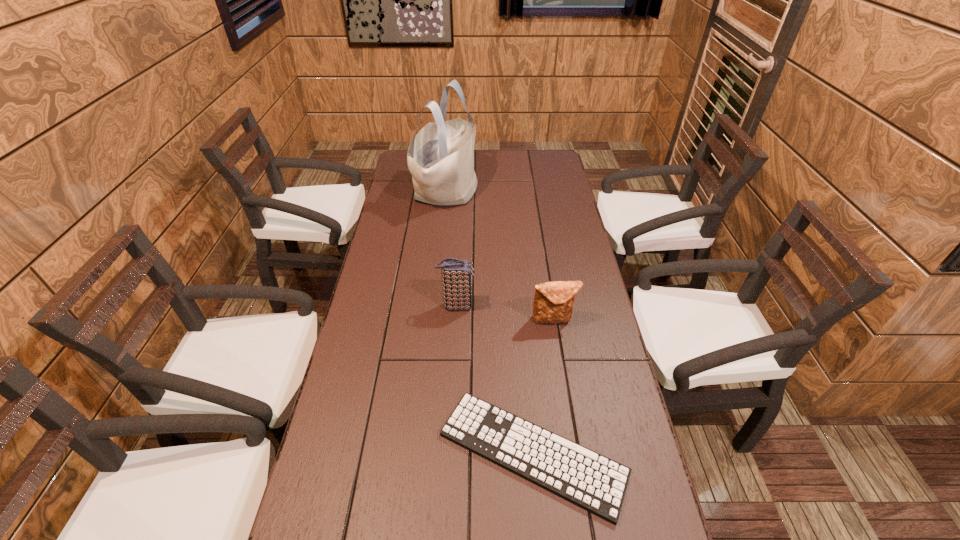
Find the location of `the tallest object`. the tallest object is located at coordinates (440, 158).

Find the location of a particular element. shopping bag is located at coordinates (440, 158).

Image resolution: width=960 pixels, height=540 pixels. Identify the location of the third shortest object. (456, 274).

Find the location of a particular element. This screenshot has height=540, width=960. the taller clutch bag is located at coordinates (456, 274).

You are a GUI agent. You are given a task and a screenshot of the screen. Output one action in this format:
    pyautogui.click(x=<x>, y=<y>)
    Task: Click on the third tallest object
    Image resolution: width=960 pixels, height=540 pixels.
    Given the screenshot: What is the action you would take?
    pyautogui.click(x=553, y=303)

Identify the location of the shorter clutch bag. This screenshot has height=540, width=960. (553, 303).

Locate an element on the screen. computer keyboard is located at coordinates (587, 479).

Identify the location of the nearest object. (587, 479).

The image size is (960, 540). In order to click on blank space located 0.350m on the front of the farthest object in this screenshot , I will do `click(437, 287)`.

Where is `free location located with the zip open on the third shortest object`? This screenshot has width=960, height=540. free location located with the zip open on the third shortest object is located at coordinates (517, 306).